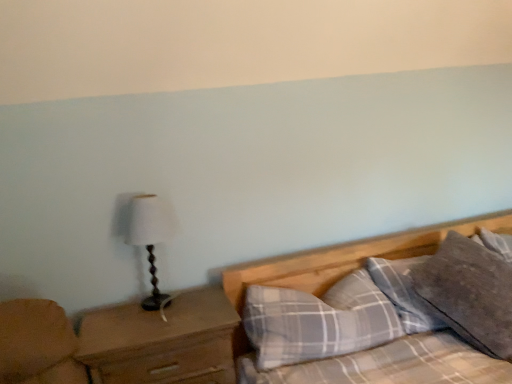
Find the location of a particular element. empty space that is ontop of brown wooden nightstand at left (from a real-world perspective) is located at coordinates [x=162, y=314].